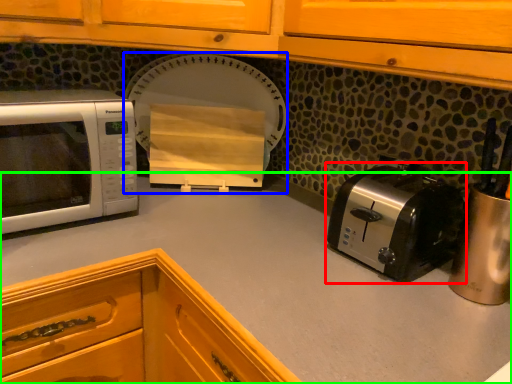
Question: Considering the real-world distances, which object is closest to toaster (highlighted by a red box)? appliance (highlighted by a blue box) or countertop (highlighted by a green box).

Choices:
 (A) appliance
 (B) countertop

Answer: (B)